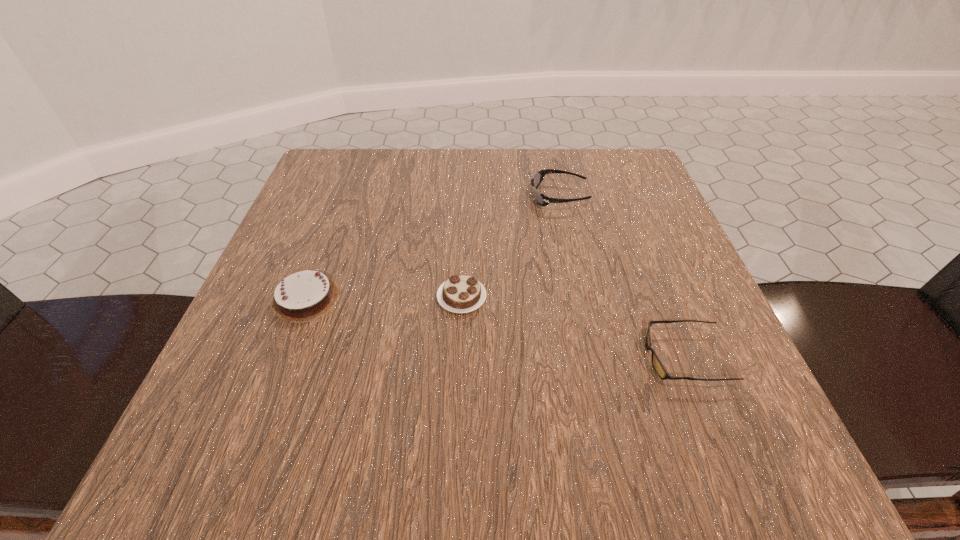
Find the location of `vacant space in between the left sunglasses and the rightmost object`. vacant space in between the left sunglasses and the rightmost object is located at coordinates (622, 277).

Where is `free space between the left chocolate cake and the second object from left to right`? free space between the left chocolate cake and the second object from left to right is located at coordinates (384, 298).

Where is `free space between the leftmost object and the farthest object`? Image resolution: width=960 pixels, height=540 pixels. free space between the leftmost object and the farthest object is located at coordinates tap(433, 247).

In order to click on free space between the nearest object and the right chocolate cake in this screenshot , I will do `click(573, 327)`.

Identify the location of the third closest object to the shorter sunglasses. The height and width of the screenshot is (540, 960). (306, 295).

This screenshot has width=960, height=540. Identify the location of object that is the closest to the left chocolate cake. (460, 294).

Locate an element on the screen. vacant point that satisfies the following two spatial constraints: 1. on the lenses of the second object from right to left; 2. on the front side of the right chocolate cake is located at coordinates (581, 298).

The height and width of the screenshot is (540, 960). Identify the location of vacant space that satisfies the following two spatial constraints: 1. on the back side of the left chocolate cake; 2. on the left side of the right chocolate cake. (306, 298).